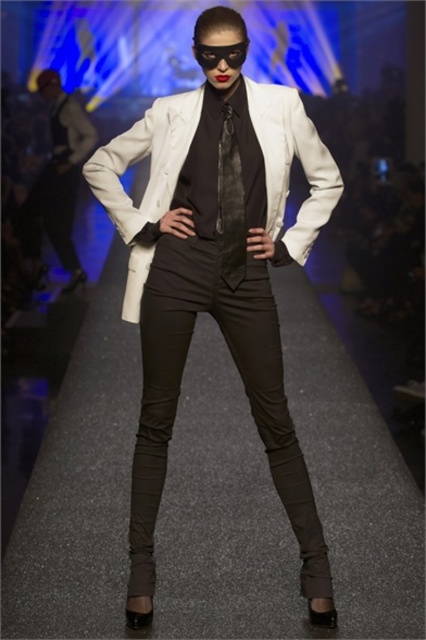
Question: Is white matte blazer at center above matte black dress at left?

Choices:
 (A) yes
 (B) no

Answer: (B)

Question: Which object is closer to the camera taking this photo?

Choices:
 (A) matte black dress at left
 (B) satin black tie at center

Answer: (B)

Question: Among these objects, which one is nearest to the camera?

Choices:
 (A) satin black tie at center
 (B) black smooth pants at center

Answer: (B)

Question: Does black smooth pants at center have a smaller size compared to satin black tie at center?

Choices:
 (A) no
 (B) yes

Answer: (A)

Question: Estimate the real-world distances between objects in this image. Which object is closer to the matte black dress at left?

Choices:
 (A) black smooth pants at center
 (B) white matte blazer at center

Answer: (B)

Question: Can you confirm if white matte blazer at center is wider than matte black dress at left?

Choices:
 (A) no
 (B) yes

Answer: (A)